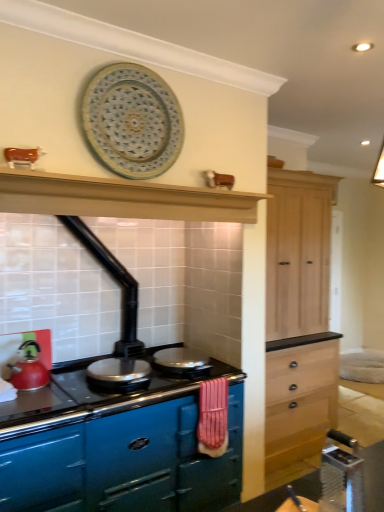
This screenshot has width=384, height=512. What are the coordinates of `free spot below blue ceramic platter at upper center (from a real-world perspective)` in the screenshot? It's located at (137, 183).